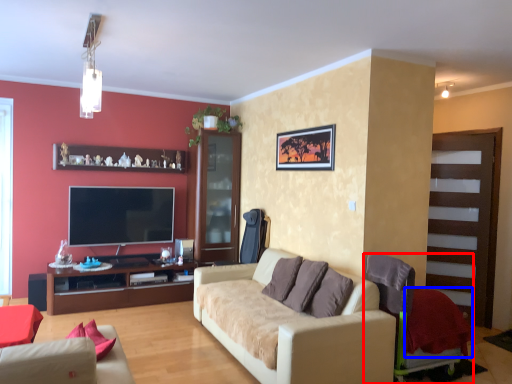
Question: Which of the following is the closest to the observer, chair (highlighted by a red box) or blanket (highlighted by a blue box)?

Choices:
 (A) chair
 (B) blanket

Answer: (A)